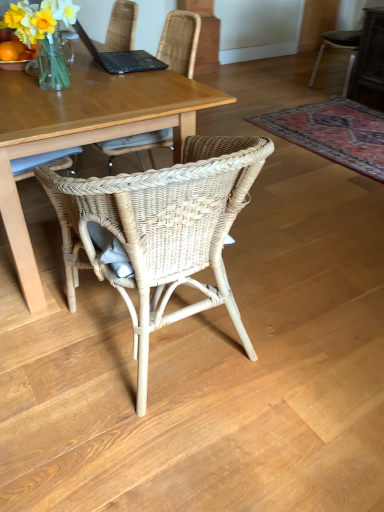
Describe the element at coordinates (341, 48) in the screenshot. I see `dark gray fabric chair at upper right, the 2th chair viewed from the front` at that location.

The height and width of the screenshot is (512, 384). In order to click on translucent glass vase at upper left in this screenshot , I will do (x=44, y=35).

Describe the element at coordinates (44, 35) in the screenshot. The image size is (384, 512). I see `translucent glass vase at upper left` at that location.

In order to click on woven rattan chair at center, the first chair positioned from the front in this screenshot , I will do `click(164, 229)`.

I want to click on carpet with intricate pattern at lower right, so click(x=333, y=133).

Describe the element at coordinates (333, 133) in the screenshot. Image resolution: width=384 pixels, height=512 pixels. I see `carpet with intricate pattern at lower right` at that location.

The height and width of the screenshot is (512, 384). Find the location of `dark gray fabric chair at upper right, acting as the 1th chair starting from the top`. dark gray fabric chair at upper right, acting as the 1th chair starting from the top is located at coordinates (341, 48).

How much distance is there between dark gray fabric chair at upper right, which is the first chair in right-to-left order, and matte wooden desk at center?

A distance of 9.68 feet exists between dark gray fabric chair at upper right, which is the first chair in right-to-left order, and matte wooden desk at center.

Does dark gray fabric chair at upper right, the 2th chair viewed from the front, have a larger size compared to matte wooden desk at center?

Actually, dark gray fabric chair at upper right, the 2th chair viewed from the front, might be smaller than matte wooden desk at center.

Choose the correct answer: Is dark gray fabric chair at upper right, which is the first chair in right-to-left order, inside matte wooden desk at center or outside it?

dark gray fabric chair at upper right, which is the first chair in right-to-left order, exists outside the volume of matte wooden desk at center.

Which of these two, dark gray fabric chair at upper right, which ranks as the second chair in bottom-to-top order, or matte wooden desk at center, stands taller?

dark gray fabric chair at upper right, which ranks as the second chair in bottom-to-top order.

Does translucent glass vase at upper left have a lesser width compared to carpet with intricate pattern at lower right?

Yes, translucent glass vase at upper left is thinner than carpet with intricate pattern at lower right.

Which of these two, translucent glass vase at upper left or carpet with intricate pattern at lower right, is smaller?

Smaller between the two is translucent glass vase at upper left.

Is translucent glass vase at upper left at the right side of carpet with intricate pattern at lower right?

Incorrect, translucent glass vase at upper left is not on the right side of carpet with intricate pattern at lower right.

Is carpet with intricate pattern at lower right at the back of translucent glass vase at upper left?

No, carpet with intricate pattern at lower right is not at the back of translucent glass vase at upper left.

Is dark gray fabric chair at upper right, the 2th chair viewed from the front, oriented away from woven rattan chair at center, the first chair positioned from the front?

No, dark gray fabric chair at upper right, the 2th chair viewed from the front, is not facing the opposite direction of woven rattan chair at center, the first chair positioned from the front.

Is woven rattan chair at center, arranged as the 1th chair when ordered from the bottom, inside dark gray fabric chair at upper right, marked as the second chair in a left-to-right arrangement?

Definitely not — woven rattan chair at center, arranged as the 1th chair when ordered from the bottom, is not inside dark gray fabric chair at upper right, marked as the second chair in a left-to-right arrangement.

Based on their sizes in the image, would you say dark gray fabric chair at upper right, acting as the 1th chair starting from the top, is bigger or smaller than woven rattan chair at center, the 2th chair in the right-to-left sequence?

dark gray fabric chair at upper right, acting as the 1th chair starting from the top, is smaller than woven rattan chair at center, the 2th chair in the right-to-left sequence.

Are dark gray fabric chair at upper right, which ranks as the second chair in bottom-to-top order, and woven rattan chair at center, marked as the 2th chair in a top-to-bottom arrangement, located far from each other?

Absolutely, dark gray fabric chair at upper right, which ranks as the second chair in bottom-to-top order, is distant from woven rattan chair at center, marked as the 2th chair in a top-to-bottom arrangement.

Which is more to the left, matte wooden desk at center or woven rattan chair at center, the first chair positioned from the front?

Positioned to the left is matte wooden desk at center.

Is matte wooden desk at center turned away from woven rattan chair at center, the first chair positioned from the front?

No.

Does point (26, 280) come farther from viewer compared to point (113, 178)?

Yes, it is.

Can you tell me how much matte wooden desk at center and woven rattan chair at center, the 2th chair in the right-to-left sequence, differ in facing direction?

The angular difference between matte wooden desk at center and woven rattan chair at center, the 2th chair in the right-to-left sequence, is 90.6 degrees.

Is there a large distance between dark gray fabric chair at upper right, marked as the second chair in a left-to-right arrangement, and carpet with intricate pattern at lower right?

No.

Could carpet with intricate pattern at lower right be considered to be inside dark gray fabric chair at upper right, acting as the 1th chair starting from the top?

Actually, carpet with intricate pattern at lower right is outside dark gray fabric chair at upper right, acting as the 1th chair starting from the top.

Is dark gray fabric chair at upper right, acting as the first chair starting from the back, facing towards carpet with intricate pattern at lower right?

No, dark gray fabric chair at upper right, acting as the first chair starting from the back, is not turned towards carpet with intricate pattern at lower right.

Considering the positions of objects dark gray fabric chair at upper right, the 2th chair viewed from the front, and carpet with intricate pattern at lower right in the image provided, who is behind, dark gray fabric chair at upper right, the 2th chair viewed from the front, or carpet with intricate pattern at lower right?

dark gray fabric chair at upper right, the 2th chair viewed from the front, is further from the camera.

Is carpet with intricate pattern at lower right with translucent glass vase at upper left?

carpet with intricate pattern at lower right is not next to translucent glass vase at upper left, and they're not touching.

Which of these two, carpet with intricate pattern at lower right or translucent glass vase at upper left, stands taller?

Standing taller between the two is translucent glass vase at upper left.

Looking at this image, does carpet with intricate pattern at lower right have a greater width compared to translucent glass vase at upper left?

Yes.

From a real-world perspective, between carpet with intricate pattern at lower right and translucent glass vase at upper left, who is vertically lower?

carpet with intricate pattern at lower right.

Would you say matte wooden desk at center is outside dark gray fabric chair at upper right, which ranks as the second chair in bottom-to-top order?

matte wooden desk at center lies outside dark gray fabric chair at upper right, which ranks as the second chair in bottom-to-top order,'s area.

Who is shorter, matte wooden desk at center or dark gray fabric chair at upper right, which ranks as the second chair in bottom-to-top order?

With less height is matte wooden desk at center.

Is matte wooden desk at center to the right of dark gray fabric chair at upper right, which ranks as the second chair in bottom-to-top order, from the viewer's perspective?

No.

This screenshot has width=384, height=512. In order to click on desk below the dark gray fabric chair at upper right, the 2th chair viewed from the front (from the image's perspective) in this screenshot , I will do coord(84,130).

I want to click on floral arrangement that appears above the carpet with intricate pattern at lower right (from a real-world perspective), so click(x=44, y=35).

Based on their spatial positions, is matte wooden desk at center or carpet with intricate pattern at lower right further from dark gray fabric chair at upper right, marked as the second chair in a left-to-right arrangement?

matte wooden desk at center lies further to dark gray fabric chair at upper right, marked as the second chair in a left-to-right arrangement, than the other object.

In the scene shown: Based on their spatial positions, is woven rattan chair at center, the 2th chair in the right-to-left sequence, or matte wooden desk at center further from dark gray fabric chair at upper right, acting as the first chair starting from the back?

The object further to dark gray fabric chair at upper right, acting as the first chair starting from the back, is woven rattan chair at center, the 2th chair in the right-to-left sequence.

Which object lies nearer to the anchor point dark gray fabric chair at upper right, acting as the first chair starting from the back, translucent glass vase at upper left or matte wooden desk at center?

matte wooden desk at center.

From the image, which object appears to be farther from carpet with intricate pattern at lower right, matte wooden desk at center or translucent glass vase at upper left?

Among the two, translucent glass vase at upper left is located further to carpet with intricate pattern at lower right.

Which object lies further to the anchor point matte wooden desk at center, dark gray fabric chair at upper right, which is the first chair in right-to-left order, or woven rattan chair at center, positioned as the 2th chair in back-to-front order?

The object further to matte wooden desk at center is dark gray fabric chair at upper right, which is the first chair in right-to-left order.

Looking at the image, which one is located further to carpet with intricate pattern at lower right, dark gray fabric chair at upper right, which ranks as the second chair in bottom-to-top order, or woven rattan chair at center, arranged as the 1th chair when ordered from the bottom?

woven rattan chair at center, arranged as the 1th chair when ordered from the bottom, is positioned further to the anchor carpet with intricate pattern at lower right.

Based on their spatial positions, is matte wooden desk at center or woven rattan chair at center, arranged as the 1th chair when ordered from the bottom, closer to translucent glass vase at upper left?

matte wooden desk at center lies closer to translucent glass vase at upper left than the other object.

When comparing their distances from translucent glass vase at upper left, does dark gray fabric chair at upper right, acting as the 1th chair starting from the top, or carpet with intricate pattern at lower right seem further?

Based on the image, dark gray fabric chair at upper right, acting as the 1th chair starting from the top, appears to be further to translucent glass vase at upper left.

Locate an element on the screen. chair between translucent glass vase at upper left and carpet with intricate pattern at lower right in the horizontal direction is located at coordinates (164, 229).

Locate an element on the screen. This screenshot has height=512, width=384. desk between woven rattan chair at center, positioned as the 2th chair in back-to-front order, and dark gray fabric chair at upper right, which ranks as the second chair in bottom-to-top order, along the z-axis is located at coordinates (84, 130).

In order to click on floral arrangement between woven rattan chair at center, which is the first chair in left-to-right order, and dark gray fabric chair at upper right, which ranks as the second chair in bottom-to-top order, in the front-back direction in this screenshot , I will do `click(44, 35)`.

Where is `mat positioned between woven rattan chair at center, the first chair positioned from the front, and dark gray fabric chair at upper right, which ranks as the second chair in bottom-to-top order, from near to far`? mat positioned between woven rattan chair at center, the first chair positioned from the front, and dark gray fabric chair at upper right, which ranks as the second chair in bottom-to-top order, from near to far is located at coordinates (333, 133).